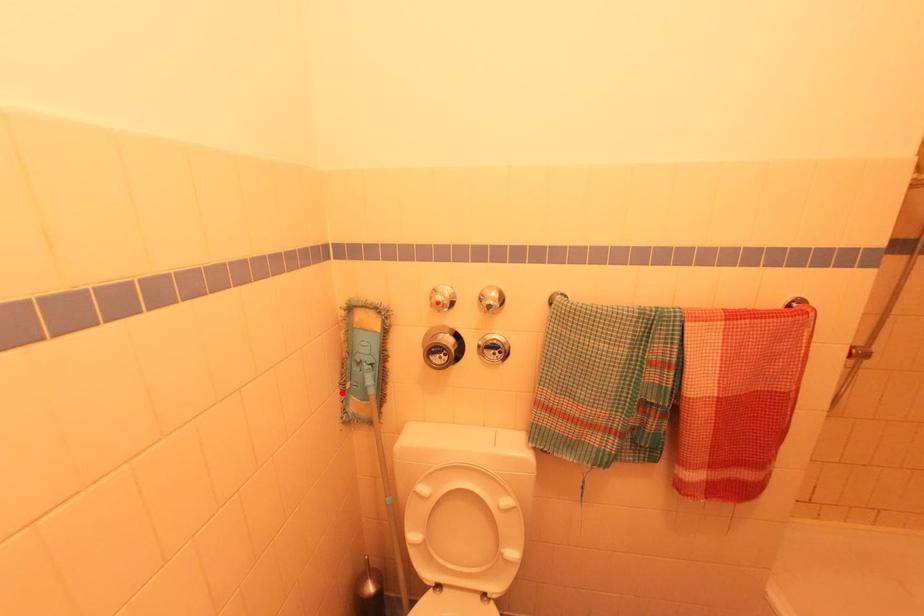
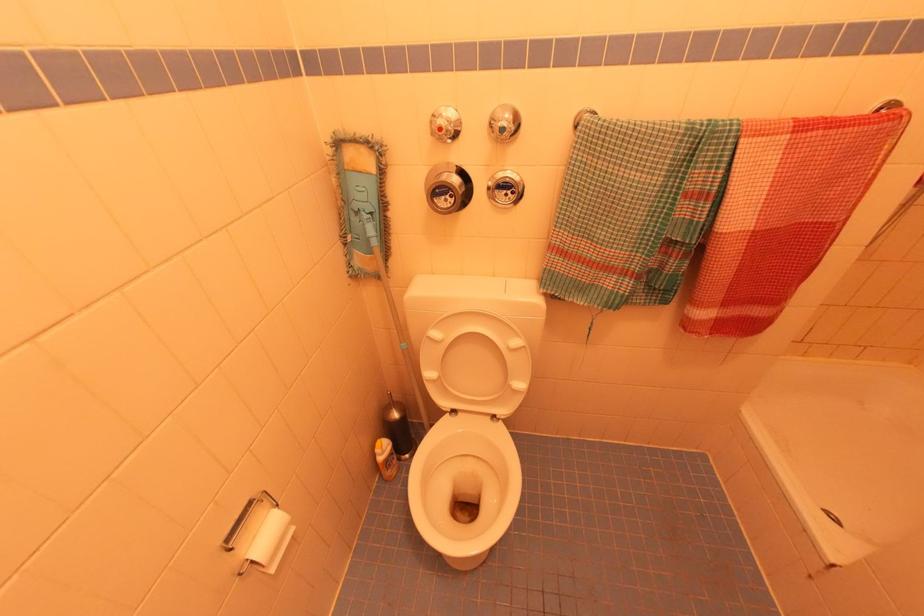
Question: I am providing you with two images of the same scene from different viewpoints. Image1 has a red point marked. In image2, the corresponding 3D location appears at what relative position? Reply with the corresponding letter.

Choices:
 (A) Closer
 (B) Farther

Answer: (A)